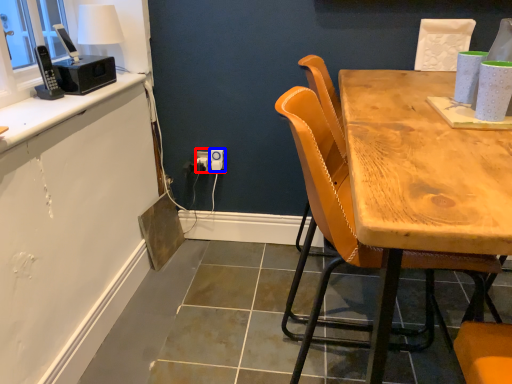
Question: Among these objects, which one is nearest to the camera, electric outlet (highlighted by a red box) or power outlet (highlighted by a blue box)?

Choices:
 (A) electric outlet
 (B) power outlet

Answer: (B)